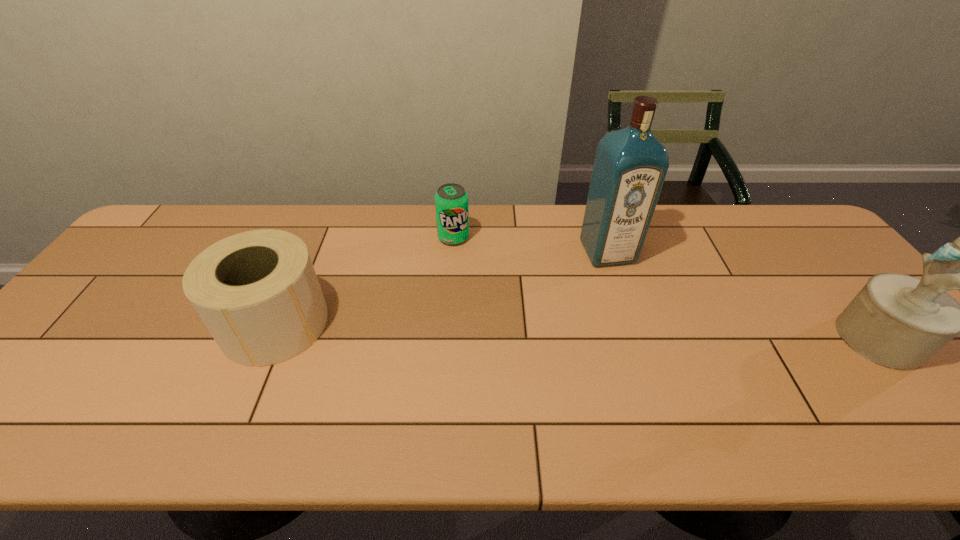
Identify the location of free spot on the desktop that is between the toilet tissue and the figurine and is positioned on the flat label side of the liquor. This screenshot has height=540, width=960. (650, 333).

Where is `free space on the desktop that is between the second shortest object and the rightmost object and is positioned on the front-facing side of the pop soda`? free space on the desktop that is between the second shortest object and the rightmost object and is positioned on the front-facing side of the pop soda is located at coordinates (518, 329).